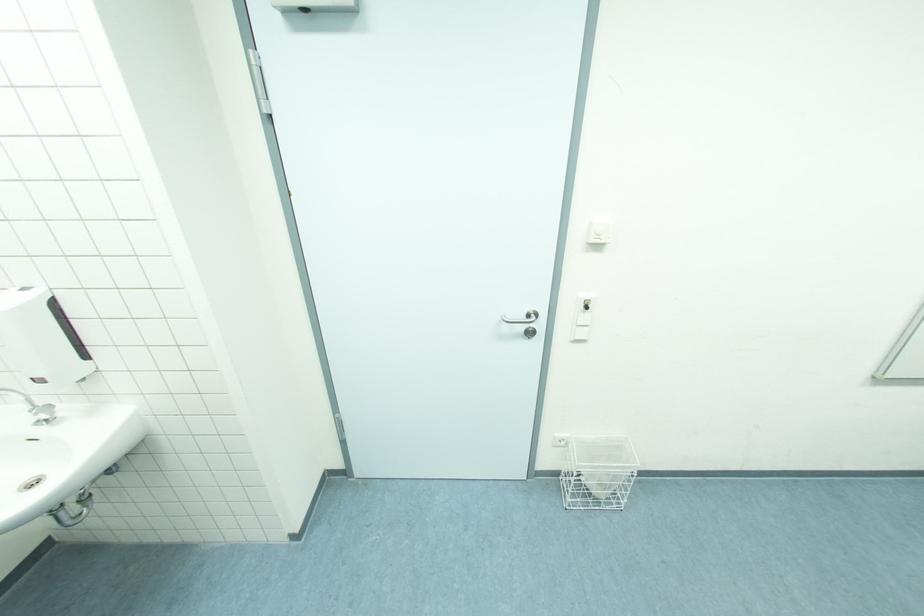
Find where to turn the faucet handle. Please return your answer as a coordinate pair (x, y).

(43, 413)